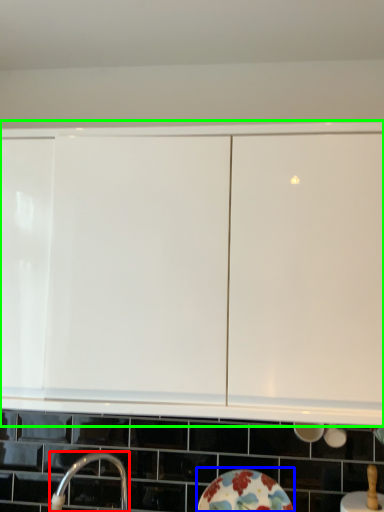
Question: Which object is the farthest from tap (highlighted by a red box)? Choose among these: plate (highlighted by a blue box) or cabinetry (highlighted by a green box).

Choices:
 (A) plate
 (B) cabinetry

Answer: (B)